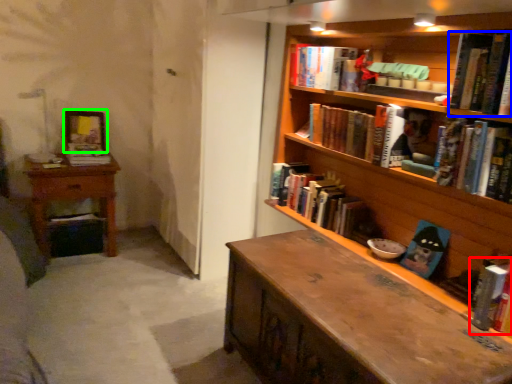
Question: Which object is positioned closest to book (highlighted by a red box)? Select from book (highlighted by a blue box) and picture frame (highlighted by a green box).

Choices:
 (A) book
 (B) picture frame

Answer: (A)